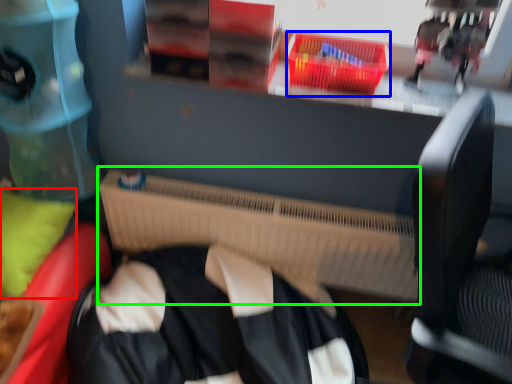
Question: Estimate the real-world distances between objects in this image. Which object is farther from pillow (highlighted by a red box), basket (highlighted by a blue box) or radiator (highlighted by a green box)?

Choices:
 (A) basket
 (B) radiator

Answer: (A)